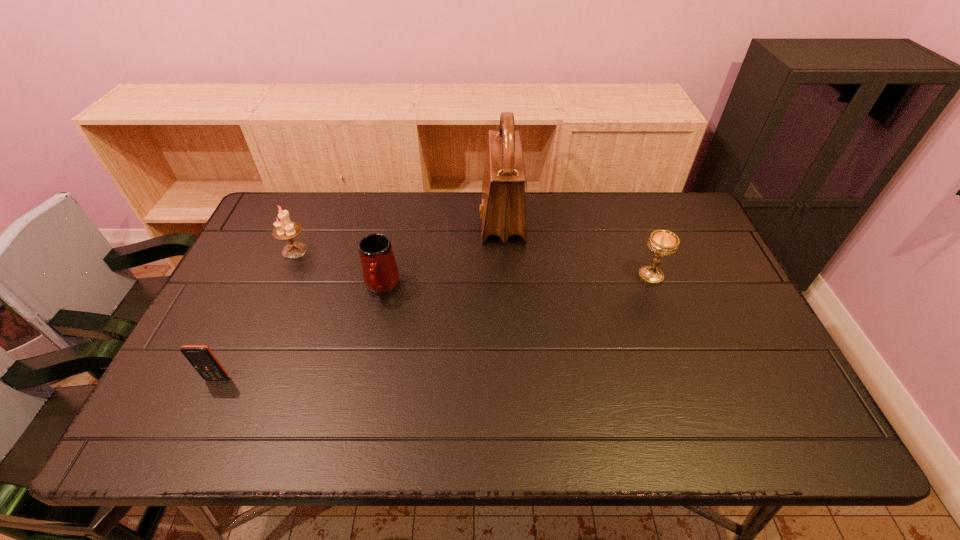
Locate an element on the screen. The width and height of the screenshot is (960, 540). object that is the second closest one to the chalice is located at coordinates tap(380, 273).

Choose which object is the third nearest neighbor to the rightmost object. Please provide its 2D coordinates. Your answer should be formatted as a tuple, i.e. [(x, y)], where the tuple contains the x and y coordinates of a point satisfying the conditions above.

[(285, 230)]

I want to click on free space that satisfies the following two spatial constraints: 1. on the front flap of the shoulder bag; 2. on the screen of the cellular telephone, so click(x=511, y=379).

Where is `vacant region that satisfies the following two spatial constraints: 1. on the front flap of the tallest object; 2. on the side of the third object from left to right with the handle`? This screenshot has height=540, width=960. vacant region that satisfies the following two spatial constraints: 1. on the front flap of the tallest object; 2. on the side of the third object from left to right with the handle is located at coordinates (505, 286).

What are the coordinates of `vacant space that satisfies the following two spatial constraints: 1. on the front flap of the shoulder bag; 2. on the side of the third object from right to left with the handle` in the screenshot? It's located at (505, 286).

This screenshot has width=960, height=540. What are the coordinates of `vacant region that satisfies the following two spatial constraints: 1. on the front flap of the shoulder bag; 2. on the screen of the nearest object` in the screenshot? It's located at (511, 379).

Where is `vacant area in the image that satisfies the following two spatial constraints: 1. on the front flap of the shoulder bag; 2. on the screen of the nearest object`? The image size is (960, 540). vacant area in the image that satisfies the following two spatial constraints: 1. on the front flap of the shoulder bag; 2. on the screen of the nearest object is located at coordinates [x=511, y=379].